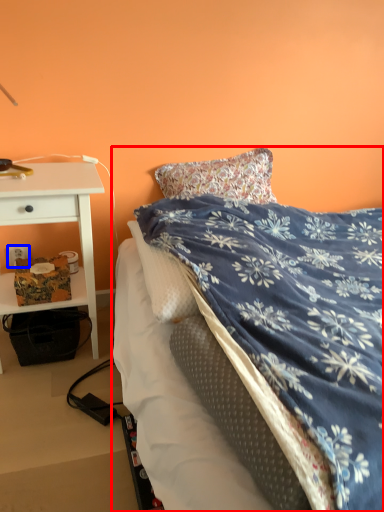
Question: Which of the following is the closest to the observer, bed (highlighted by a red box) or power outlet (highlighted by a blue box)?

Choices:
 (A) bed
 (B) power outlet

Answer: (A)